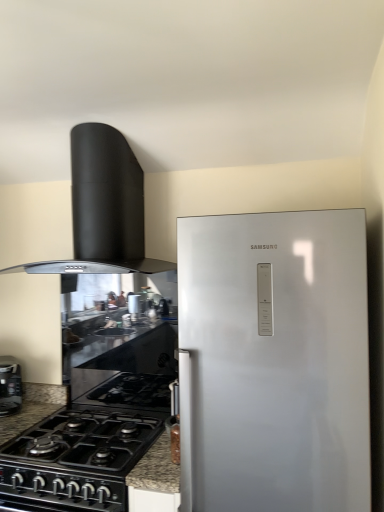
Where is `black matte range hood at upper left`? This screenshot has height=512, width=384. black matte range hood at upper left is located at coordinates (105, 206).

Find the location of `black glossy toaster at lower left`. black glossy toaster at lower left is located at coordinates point(10,386).

From a real-world perspective, between black matte/glossy gas stove at lower left and black glossy toaster at lower left, who is vertically lower?

black matte/glossy gas stove at lower left, from a real-world perspective.

In the scene shown: Can you tell me how much black matte/glossy gas stove at lower left and black glossy toaster at lower left differ in facing direction?

The angle between the facing direction of black matte/glossy gas stove at lower left and the facing direction of black glossy toaster at lower left is 42.5 degrees.

Does point (63, 467) come farther from viewer compared to point (6, 397)?

No, it is not.

Looking at this image, which of these two, black matte/glossy gas stove at lower left or black glossy toaster at lower left, stands taller?

Standing taller between the two is black glossy toaster at lower left.

Between black glass countertop at center and black matte range hood at upper left, which one has larger size?

black matte range hood at upper left.

Based on the photo, is black glass countertop at center far from black matte range hood at upper left?

black glass countertop at center is near black matte range hood at upper left, not far away.

Does black glass countertop at center have a lesser width compared to black matte range hood at upper left?

Correct, the width of black glass countertop at center is less than that of black matte range hood at upper left.

How far apart are black glossy toaster at lower left and black matte/glossy gas stove at lower left?

A distance of 48.38 centimeters exists between black glossy toaster at lower left and black matte/glossy gas stove at lower left.

From a real-world perspective, relative to black matte/glossy gas stove at lower left, is black glossy toaster at lower left vertically above or below?

From a real-world perspective, black glossy toaster at lower left is physically above black matte/glossy gas stove at lower left.

Is black glossy toaster at lower left oriented away from black matte/glossy gas stove at lower left?

No, black glossy toaster at lower left's orientation is not away from black matte/glossy gas stove at lower left.

Is point (8, 397) closer or farther from the camera than point (52, 472)?

Point (8, 397) appears to be farther away from the viewer than point (52, 472).

From a real-world perspective, who is located lower, black matte range hood at upper left or black glossy toaster at lower left?

black glossy toaster at lower left.

Is black matte range hood at upper left positioned with its back to black glossy toaster at lower left?

No, black matte range hood at upper left is not facing away from black glossy toaster at lower left.

Considering the sizes of objects black matte range hood at upper left and black glossy toaster at lower left in the image provided, who is shorter, black matte range hood at upper left or black glossy toaster at lower left?

Standing shorter between the two is black glossy toaster at lower left.

This screenshot has width=384, height=512. I want to click on kitchen appliance below the black glass countertop at center (from the image's perspective), so click(10, 386).

Can we say black glossy toaster at lower left lies outside black glass countertop at center?

black glossy toaster at lower left is positioned outside black glass countertop at center.

Considering the sizes of black glossy toaster at lower left and black glass countertop at center in the image, is black glossy toaster at lower left wider or thinner than black glass countertop at center?

Clearly, black glossy toaster at lower left has more width compared to black glass countertop at center.

Considering the points (3, 386) and (109, 369), which point is in front, point (3, 386) or point (109, 369)?

The point (3, 386) is closer to the camera.

Looking at this image, which is nearer, (2,410) or (81,167)?

The point (81,167) is in front.

Considering the positions of objects black glossy toaster at lower left and black matte range hood at upper left in the image provided, who is behind, black glossy toaster at lower left or black matte range hood at upper left?

black glossy toaster at lower left is further from the camera.

Which object is thinner, black glossy toaster at lower left or black matte range hood at upper left?

black glossy toaster at lower left is thinner.

From the image's perspective, between black glossy toaster at lower left and black matte range hood at upper left, which one is located above?

black matte range hood at upper left is shown above in the image.

Which is in front, point (30, 470) or point (83, 351)?

The point (30, 470) is in front.

From the picture: Is black matte/glossy gas stove at lower left shorter than black glass countertop at center?

Yes, black matte/glossy gas stove at lower left is shorter than black glass countertop at center.

From a real-world perspective, is black matte/glossy gas stove at lower left over black glass countertop at center?

No, from a real-world perspective, black matte/glossy gas stove at lower left is not on top of black glass countertop at center.

From the image's perspective, is black matte/glossy gas stove at lower left positioned above or below black glass countertop at center?

Based on their image positions, black matte/glossy gas stove at lower left is located beneath black glass countertop at center.

You are a GUI agent. You are given a task and a screenshot of the screen. Output one action in this format:
    pyautogui.click(x=<x>, y=<y>)
    Task: Click on the kitchen appliance behind the black matte/glossy gas stove at lower left
    Image resolution: width=384 pixels, height=512 pixels.
    Given the screenshot: What is the action you would take?
    pyautogui.click(x=10, y=386)

The image size is (384, 512). I want to click on home appliance on the left side of black glass countertop at center, so click(105, 206).

Looking at the image, which one is located further to black glossy toaster at lower left, black matte/glossy gas stove at lower left or black matte range hood at upper left?

black matte range hood at upper left is further to black glossy toaster at lower left.

When comparing their distances from black matte/glossy gas stove at lower left, does black matte range hood at upper left or black glossy toaster at lower left seem further?

black matte range hood at upper left lies further to black matte/glossy gas stove at lower left than the other object.

Based on their spatial positions, is black glass countertop at center or black glossy toaster at lower left closer to black matte/glossy gas stove at lower left?

black glass countertop at center lies closer to black matte/glossy gas stove at lower left than the other object.

Considering their positions, is black glossy toaster at lower left positioned closer to black matte/glossy gas stove at lower left than black matte range hood at upper left?

black glossy toaster at lower left lies closer to black matte/glossy gas stove at lower left than the other object.

Which object lies nearer to the anchor point black glass countertop at center, black matte range hood at upper left or black glossy toaster at lower left?

Based on the image, black glossy toaster at lower left appears to be nearer to black glass countertop at center.

Consider the image. From the image, which object appears to be farther from black matte/glossy gas stove at lower left, black matte range hood at upper left or black glass countertop at center?

The object further to black matte/glossy gas stove at lower left is black matte range hood at upper left.

Consider the image. Based on their spatial positions, is black matte/glossy gas stove at lower left or black glass countertop at center further from black glossy toaster at lower left?

black glass countertop at center.

Considering their positions, is black glass countertop at center positioned closer to black glossy toaster at lower left than black matte/glossy gas stove at lower left?

The object closer to black glossy toaster at lower left is black matte/glossy gas stove at lower left.

You are a GUI agent. You are given a task and a screenshot of the screen. Output one action in this format:
    pyautogui.click(x=<x>, y=<y>)
    Task: Click on the counter top that lies between black matte range hood at upper left and black matte/glossy gas stove at lower left from top to bottom
    Image resolution: width=384 pixels, height=512 pixels.
    Given the screenshot: What is the action you would take?
    pyautogui.click(x=124, y=347)

The height and width of the screenshot is (512, 384). I want to click on kitchen appliance that lies between black matte range hood at upper left and black matte/glossy gas stove at lower left from top to bottom, so click(10, 386).

This screenshot has width=384, height=512. What are the coordinates of `kitchen appliance between black matte/glossy gas stove at lower left and black glass countertop at center from front to back` in the screenshot? It's located at (10, 386).

The height and width of the screenshot is (512, 384). I want to click on counter top between black matte range hood at upper left and black glossy toaster at lower left vertically, so click(124, 347).